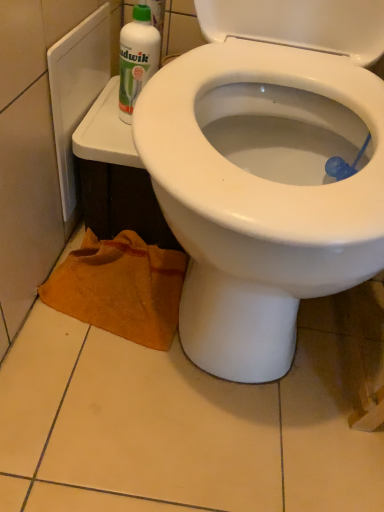
The image size is (384, 512). What are the coordinates of `vacant space in orange towel at lower left (from a real-world perspective)` in the screenshot? It's located at (95, 286).